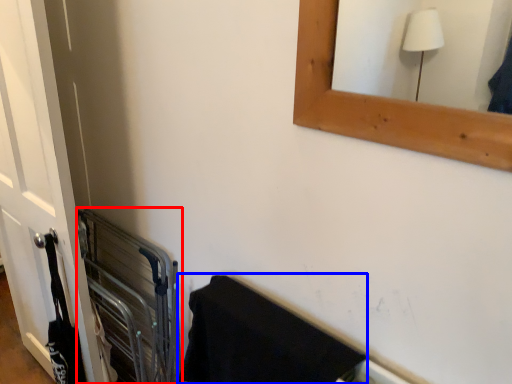
Question: Which object appears farthest to the camera in this image, balustrade (highlighted by a red box) or bath towel (highlighted by a blue box)?

Choices:
 (A) balustrade
 (B) bath towel

Answer: (A)